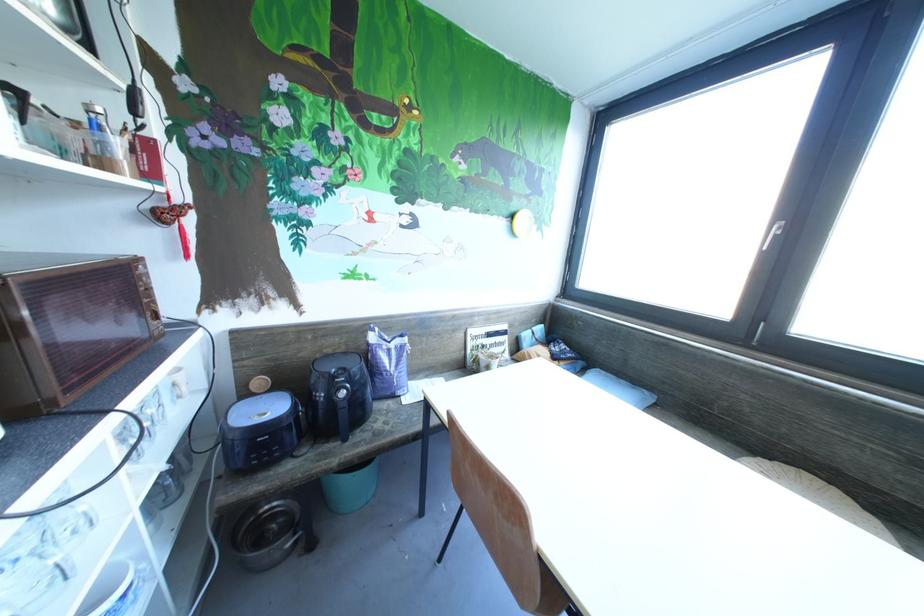
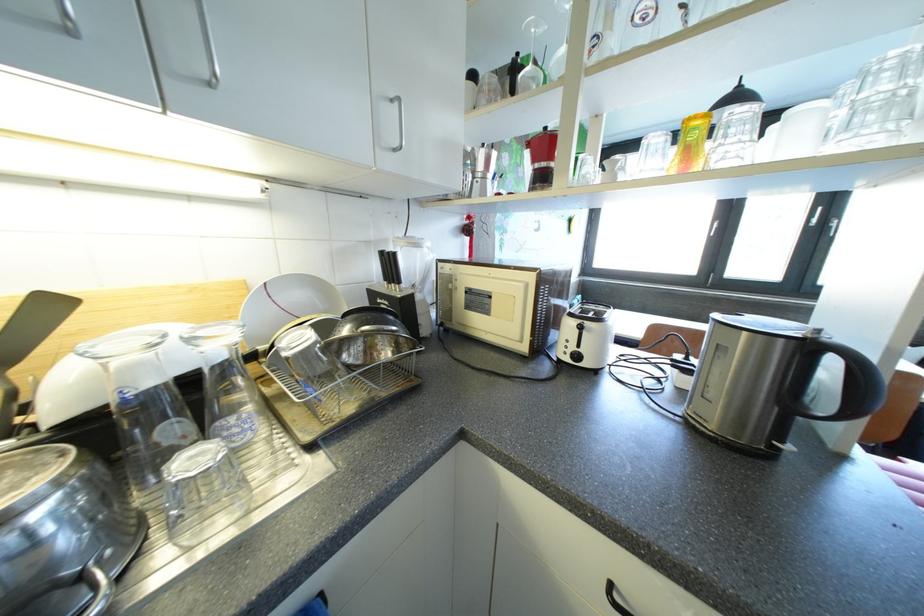
Question: What movement of the cameraman would produce the second image?

Choices:
 (A) Left
 (B) Right
 (C) Forward
 (D) Backward

Answer: (A)